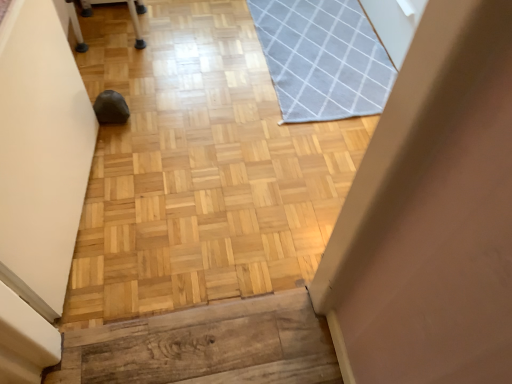
I want to click on vacant area that is in front of matte white plastic chair at upper left, so click(x=116, y=71).